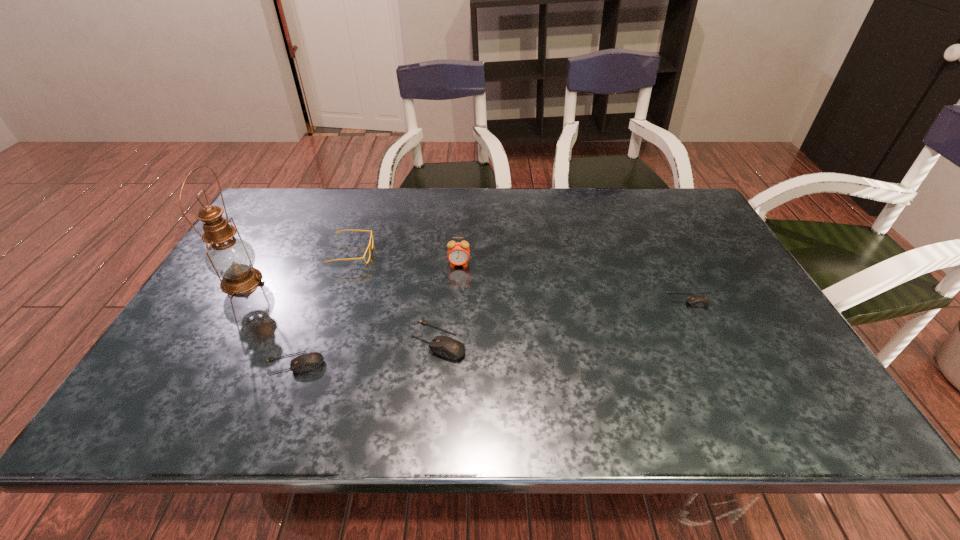
Identify the location of vacant point located 0.240m on the back of the leftmost mouse. 326,281.

You are a GUI agent. You are given a task and a screenshot of the screen. Output one action in this format:
    pyautogui.click(x=<x>, y=<y>)
    Task: Click on the vacant region located 0.350m on the back of the third shortest object
    
    Given the screenshot: What is the action you would take?
    (x=447, y=235)

Find the location of a particular element. free space located on the left of the rightmost mouse is located at coordinates (607, 300).

Locate an element on the screen. vacant space situated 0.220m in front of the lenses of the spectacles is located at coordinates (448, 254).

Locate an element on the screen. Image resolution: width=960 pixels, height=540 pixels. vacant space located on the back of the oil lamp is located at coordinates (273, 228).

I want to click on blank area located 0.120m on the face of the alarm clock, so click(457, 298).

In order to click on object present at the left edge in this screenshot , I will do coord(232,259).

Locate an element on the screen. The width and height of the screenshot is (960, 540). object at the right edge is located at coordinates (694, 300).

The width and height of the screenshot is (960, 540). Identify the location of free spot at the far edge of the desktop. (415, 204).

What are the coordinates of `free point at the near edge` in the screenshot? It's located at (401, 379).